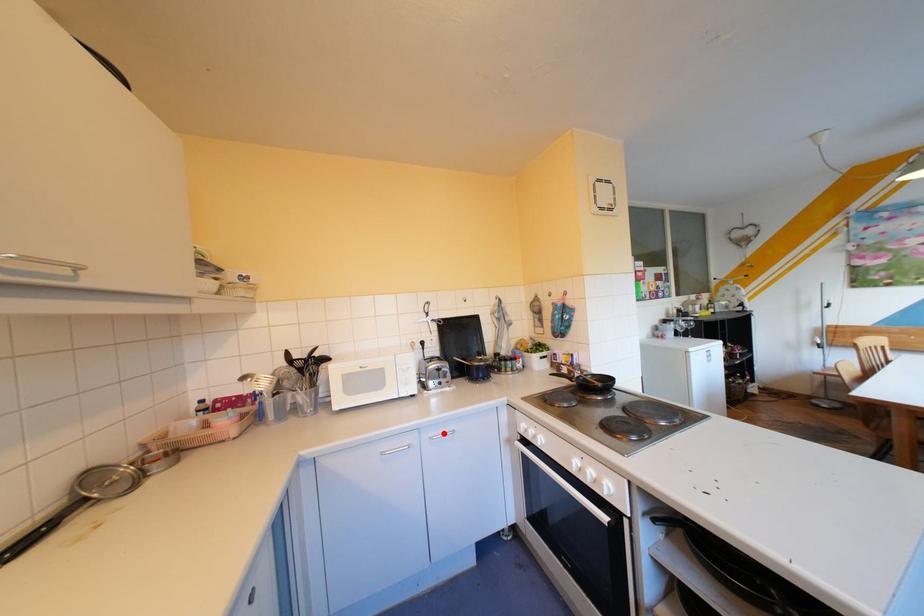
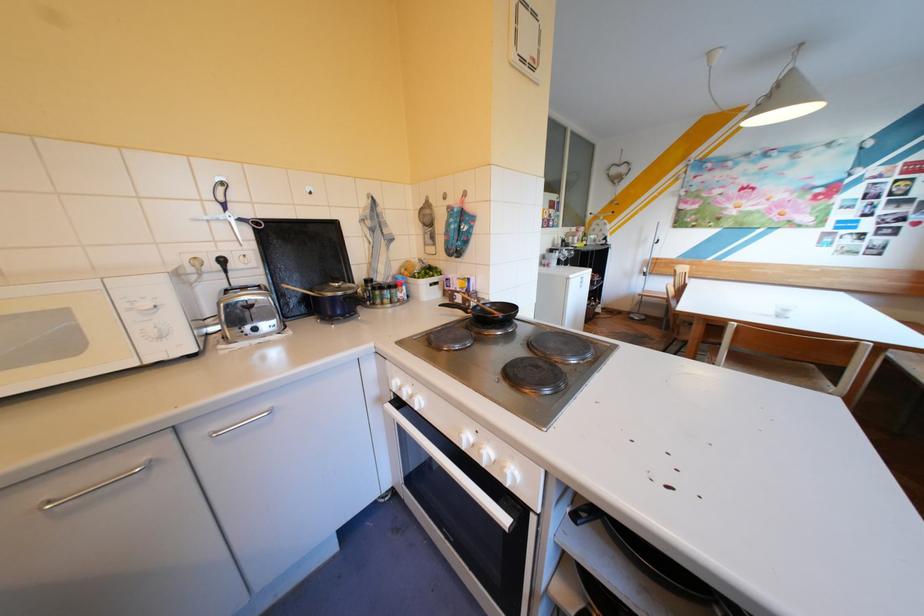
Where in the second image is the point corresponding to the highlighted location from the first image?

(226, 427)